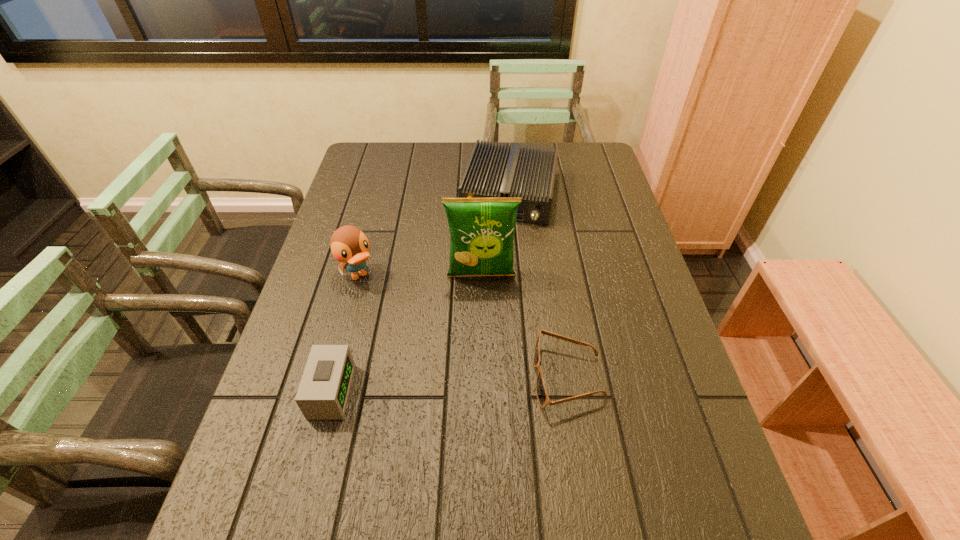
Find the location of a particular element. free space between the sunglasses and the second shortest object is located at coordinates point(449,384).

Identify the location of empty space that is in between the crisp (potato chip) and the duck. This screenshot has width=960, height=540. (420, 276).

The image size is (960, 540). Find the location of `vacant region between the fourth tallest object and the shortest object`. vacant region between the fourth tallest object and the shortest object is located at coordinates (449, 384).

Image resolution: width=960 pixels, height=540 pixels. What are the coordinates of `vacant area that lies between the farthest object and the shortest object` in the screenshot? It's located at (539, 286).

This screenshot has height=540, width=960. I want to click on empty location between the duck and the fourth tallest object, so click(x=345, y=334).

Locate an element on the screen. This screenshot has height=540, width=960. free point between the crisp (potato chip) and the second shortest object is located at coordinates (406, 334).

Locate an element on the screen. This screenshot has height=540, width=960. vacant space in between the fourth shortest object and the fourth tallest object is located at coordinates (345, 334).

Identify which object is the second nearest to the second shortest object. Please provide its 2D coordinates. Your answer should be formatted as a tuple, i.e. [(x, y)], where the tuple contains the x and y coordinates of a point satisfying the conditions above.

[(482, 230)]

Select which object appears as the closest to the tallest object. Please provide its 2D coordinates. Your answer should be formatted as a tuple, i.e. [(x, y)], where the tuple contains the x and y coordinates of a point satisfying the conditions above.

[(493, 171)]

The height and width of the screenshot is (540, 960). Find the location of `vacant space that satisfies the following two spatial constraints: 1. on the front side of the tallest object; 2. on the right side of the duck`. vacant space that satisfies the following two spatial constraints: 1. on the front side of the tallest object; 2. on the right side of the duck is located at coordinates (359, 276).